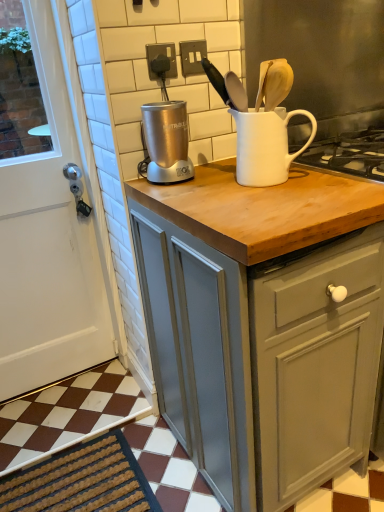
What do you see at coordinates (278, 323) in the screenshot?
I see `matte gray cabinet at center` at bounding box center [278, 323].

Measure the distance between white matte door at left and camera.

white matte door at left is 4.28 feet away from camera.

Identify the location of satin silver blender at upper center. (167, 142).

Describe the element at coordinates (266, 145) in the screenshot. This screenshot has height=512, width=384. I see `white ceramic jug at upper center` at that location.

Locate an element on the screen. dark brown textured mat at lower left is located at coordinates (82, 481).

Would you consider matte gray cabinet at center to be distant from white matte door at left?

They are positioned close to each other.

Is matte gray cabinet at center wider or thinner than white matte door at left?

Clearly, matte gray cabinet at center has more width compared to white matte door at left.

Between matte gray cabinet at center and white matte door at left, which one has more height?

white matte door at left.

Is dark brown textured mat at lower left at the left side of satin silver blender at upper center?

Correct, you'll find dark brown textured mat at lower left to the left of satin silver blender at upper center.

Does dark brown textured mat at lower left have a lesser width compared to satin silver blender at upper center?

No, dark brown textured mat at lower left is not thinner than satin silver blender at upper center.

Locate an element on the screen. kitchen appliance that is on the right side of dark brown textured mat at lower left is located at coordinates (167, 142).

From the image's perspective, is dark brown textured mat at lower left positioned above or below satin silver blender at upper center?

dark brown textured mat at lower left is situated lower than satin silver blender at upper center in the image.

Does point (182, 180) appear closer or farther from the camera than point (237, 135)?

Point (182, 180) is closer to the camera than point (237, 135).

Consider the image. Between satin silver blender at upper center and white ceramic jug at upper center, which one appears on the right side from the viewer's perspective?

white ceramic jug at upper center is more to the right.

Could you tell me if white matte door at left is facing satin silver blender at upper center?

No, white matte door at left is not oriented towards satin silver blender at upper center.

Is white matte door at left far away from satin silver blender at upper center?

white matte door at left is actually quite close to satin silver blender at upper center.

Is white matte door at left surrounding satin silver blender at upper center?

No, white matte door at left does not contain satin silver blender at upper center.

Based on their positions, is white ceramic jug at upper center located to the left or right of matte gray cabinet at center?

Based on their positions, white ceramic jug at upper center is located to the left of matte gray cabinet at center.

From the image's perspective, which is above, white ceramic jug at upper center or matte gray cabinet at center?

white ceramic jug at upper center, from the image's perspective.

Is white ceramic jug at upper center in front of matte gray cabinet at center?

No, white ceramic jug at upper center is further to the viewer.

Which of these two, white ceramic jug at upper center or matte gray cabinet at center, stands taller?

Standing taller between the two is matte gray cabinet at center.

Is dark brown textured mat at lower left positioned with its back to white ceramic jug at upper center?

No, dark brown textured mat at lower left is not facing away from white ceramic jug at upper center.

Between dark brown textured mat at lower left and white ceramic jug at upper center, which one has smaller size?

With smaller size is white ceramic jug at upper center.

Is dark brown textured mat at lower left taller than white ceramic jug at upper center?

In fact, dark brown textured mat at lower left may be shorter than white ceramic jug at upper center.

Is point (35, 316) closer to camera compared to point (100, 480)?

No.

Does white matte door at left have a lesser width compared to dark brown textured mat at lower left?

Yes, white matte door at left is thinner than dark brown textured mat at lower left.

Can you confirm if white matte door at left is smaller than dark brown textured mat at lower left?

No, white matte door at left is not smaller than dark brown textured mat at lower left.

At what (x,y) coordinates should I click in order to perform the action: click on door that is above the matte gray cabinet at center (from the image's perspective). Please return your answer as a coordinate pair (x, y). Looking at the image, I should click on (48, 247).

The width and height of the screenshot is (384, 512). I want to click on doormat on the left of satin silver blender at upper center, so click(x=82, y=481).

Which object lies further to the anchor point dark brown textured mat at lower left, satin silver blender at upper center or matte gray cabinet at center?

Based on the image, satin silver blender at upper center appears to be further to dark brown textured mat at lower left.

Estimate the real-world distances between objects in this image. Which object is further from satin silver blender at upper center, white ceramic jug at upper center or matte gray cabinet at center?

The object further to satin silver blender at upper center is matte gray cabinet at center.

Based on their spatial positions, is satin silver blender at upper center or white ceramic jug at upper center closer to white matte door at left?

The object closer to white matte door at left is satin silver blender at upper center.

Looking at the image, which one is located closer to white ceramic jug at upper center, white matte door at left or dark brown textured mat at lower left?

Based on the image, white matte door at left appears to be nearer to white ceramic jug at upper center.

Considering their positions, is dark brown textured mat at lower left positioned closer to white ceramic jug at upper center than matte gray cabinet at center?

Among the two, matte gray cabinet at center is located nearer to white ceramic jug at upper center.

Considering their positions, is white matte door at left positioned further to white ceramic jug at upper center than matte gray cabinet at center?

The object further to white ceramic jug at upper center is white matte door at left.

Estimate the real-world distances between objects in this image. Which object is closer to white matte door at left, satin silver blender at upper center or matte gray cabinet at center?

satin silver blender at upper center.

In the scene shown: Estimate the real-world distances between objects in this image. Which object is further from dark brown textured mat at lower left, white matte door at left or satin silver blender at upper center?

Based on the image, satin silver blender at upper center appears to be further to dark brown textured mat at lower left.

This screenshot has height=512, width=384. Identify the location of kitchen appliance between white matte door at left and white ceramic jug at upper center in the horizontal direction. (167, 142).

Locate an element on the screen. The height and width of the screenshot is (512, 384). cabinetry between white ceramic jug at upper center and dark brown textured mat at lower left in the vertical direction is located at coordinates (278, 323).

At what (x,y) coordinates should I click in order to perform the action: click on jug situated between white matte door at left and matte gray cabinet at center from left to right. Please return your answer as a coordinate pair (x, y). Looking at the image, I should click on (266, 145).

You are a GUI agent. You are given a task and a screenshot of the screen. Output one action in this format:
    pyautogui.click(x=<x>, y=<y>)
    Task: Click on the cabinetry between satin silver blender at upper center and dark brown textured mat at lower left vertically
    
    Given the screenshot: What is the action you would take?
    pyautogui.click(x=278, y=323)